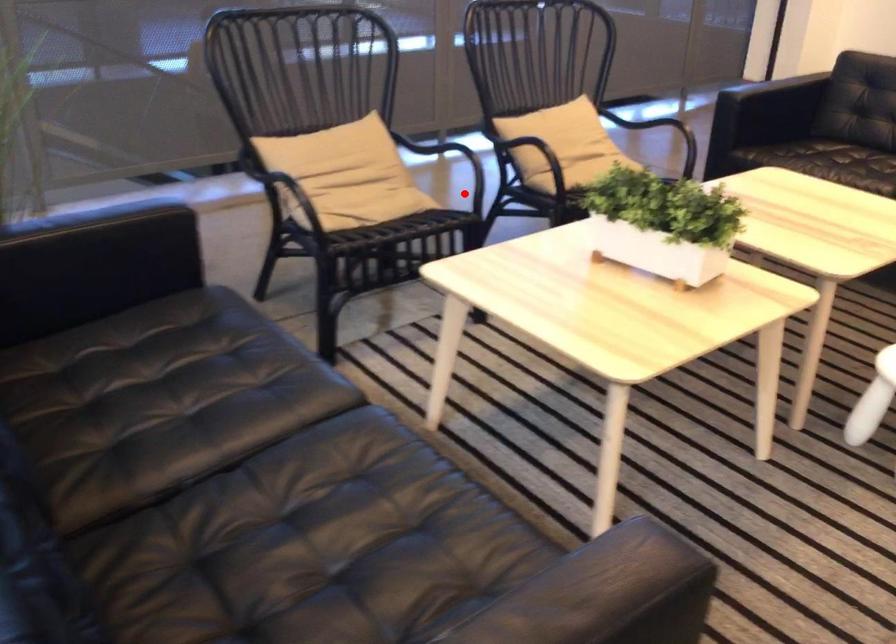
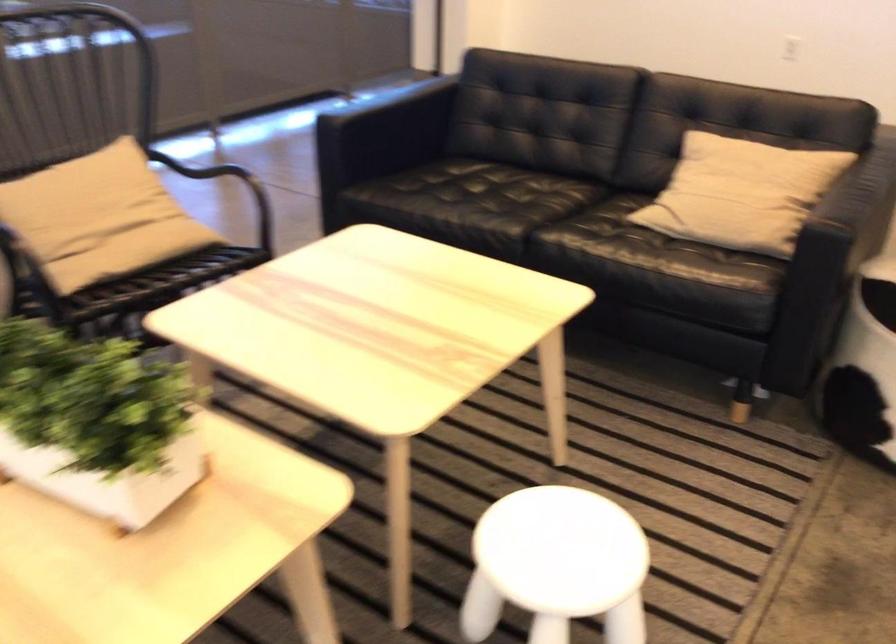
Question: I am providing you with two images of the same scene from different viewpoints. Image1 has a red point marked. In image2, the corresponding 3D location appears at what relative position? Reply with the corresponding letter.

Choices:
 (A) Closer
 (B) Farther

Answer: (A)